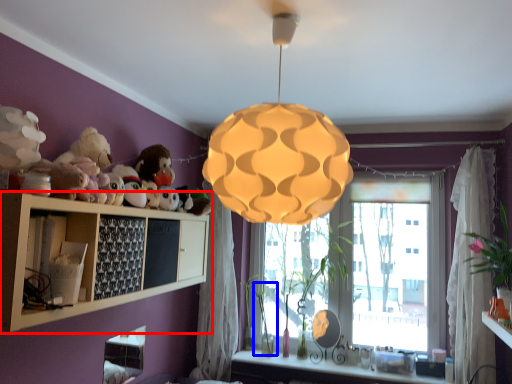
Question: Which object appears farthest to the camera in this image, shelf (highlighted by a red box) or plant (highlighted by a blue box)?

Choices:
 (A) shelf
 (B) plant

Answer: (B)